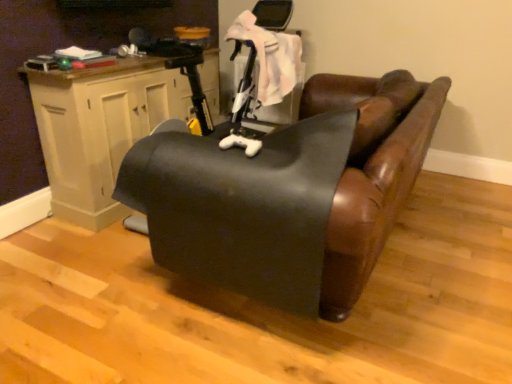
Question: From a real-world perspective, is black leather couch at center beneath wooden cabinet at left?

Choices:
 (A) no
 (B) yes

Answer: (B)

Question: From the image's perspective, does black leather couch at center appear higher than wooden cabinet at left?

Choices:
 (A) no
 (B) yes

Answer: (A)

Question: From the image's perspective, does black leather couch at center appear lower than wooden cabinet at left?

Choices:
 (A) no
 (B) yes

Answer: (B)

Question: Is black leather couch at center beside wooden cabinet at left?

Choices:
 (A) yes
 (B) no

Answer: (B)

Question: Is black leather couch at center thinner than wooden cabinet at left?

Choices:
 (A) no
 (B) yes

Answer: (A)

Question: Does black leather couch at center have a lesser height compared to wooden cabinet at left?

Choices:
 (A) yes
 (B) no

Answer: (A)

Question: Is wooden cabinet at left shorter than black leather couch at center?

Choices:
 (A) no
 (B) yes

Answer: (A)

Question: Could black leather couch at center be considered to be inside wooden cabinet at left?

Choices:
 (A) yes
 (B) no

Answer: (B)

Question: Are wooden cabinet at left and black leather couch at center beside each other?

Choices:
 (A) yes
 (B) no

Answer: (B)

Question: Is wooden cabinet at left to the left of black leather couch at center from the viewer's perspective?

Choices:
 (A) no
 (B) yes

Answer: (B)

Question: From the image's perspective, is wooden cabinet at left below black leather couch at center?

Choices:
 (A) no
 (B) yes

Answer: (A)

Question: Does wooden cabinet at left have a larger size compared to black leather couch at center?

Choices:
 (A) no
 (B) yes

Answer: (A)

Question: Is black leather couch at center in front of or behind wooden cabinet at left in the image?

Choices:
 (A) behind
 (B) front

Answer: (B)